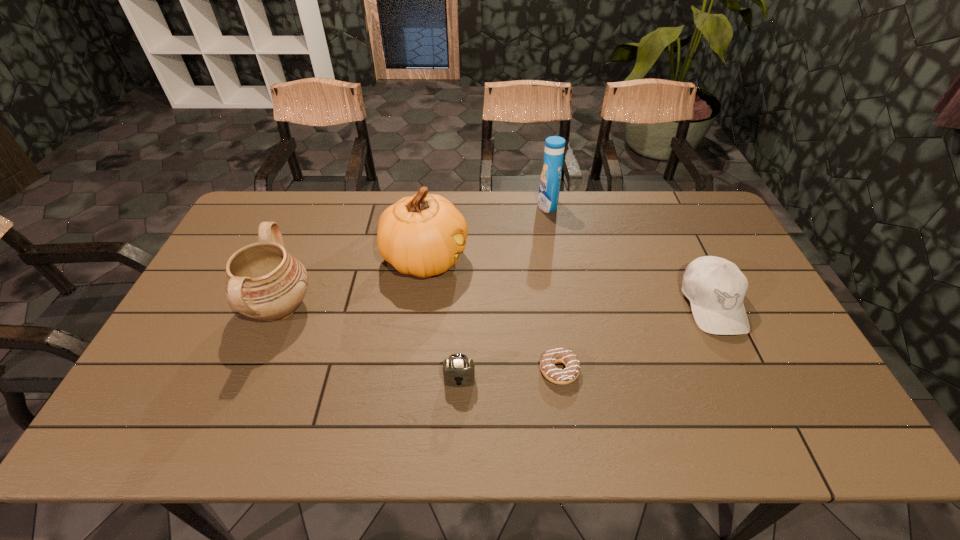
Locate an element on the screen. This screenshot has height=540, width=960. the farthest object is located at coordinates (550, 180).

Locate an element on the screen. The image size is (960, 540). pumpkin is located at coordinates (422, 235).

Locate an element on the screen. The height and width of the screenshot is (540, 960). urn is located at coordinates (264, 282).

Where is `baseball cap`? The width and height of the screenshot is (960, 540). baseball cap is located at coordinates tap(715, 287).

This screenshot has height=540, width=960. What are the coordinates of `padlock` in the screenshot? It's located at (458, 370).

This screenshot has width=960, height=540. Identify the location of the shortest object. (555, 375).

Locate an element on the screen. This screenshot has height=540, width=960. free space located on the front-facing side of the detergent is located at coordinates (482, 205).

Identify the location of free region located on the front-facing side of the detergent. The width and height of the screenshot is (960, 540). 491,205.

Where is `free location located on the front-facing side of the detergent`? Image resolution: width=960 pixels, height=540 pixels. free location located on the front-facing side of the detergent is located at coordinates (440, 205).

In order to click on vacant space located 0.260m on the front face of the pumpkin in this screenshot , I will do `click(551, 259)`.